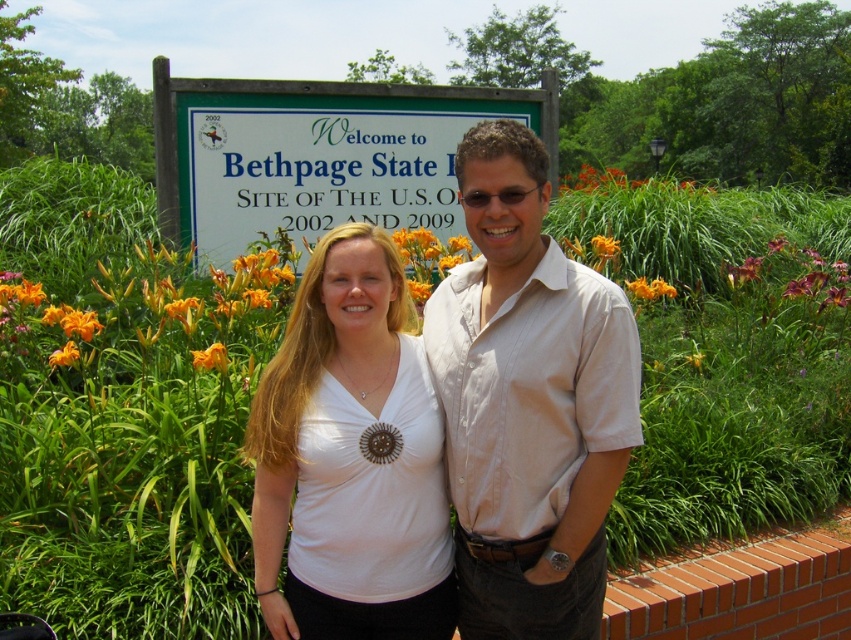
Between point (270, 104) and point (647, 289), which one is positioned behind?

Point (270, 104)

Identify the location of green plastic sign at upper center. (317, 154).

The height and width of the screenshot is (640, 851). Identify the location of green plastic sign at upper center. (317, 154).

Does light beige shirt at center lie behind orange matte flower at right?

No, light beige shirt at center is in front of orange matte flower at right.

Identify the location of light beige shirt at center. This screenshot has height=640, width=851. (x=528, y=401).

Who is more distant from viewer, (600, 282) or (638, 280)?

The point (638, 280) is more distant.

Where is `light beige shirt at center`? The height and width of the screenshot is (640, 851). light beige shirt at center is located at coordinates (528, 401).

Who is positioned more to the right, orange petal at upper right or orange/yellow petals at center?

Positioned to the right is orange petal at upper right.

Which is in front, point (666, 180) or point (609, 253)?

Point (609, 253) is in front.

The height and width of the screenshot is (640, 851). Describe the element at coordinates (623, 182) in the screenshot. I see `orange petal at upper right` at that location.

The height and width of the screenshot is (640, 851). Find the location of `orange petal at upper right`. orange petal at upper right is located at coordinates (623, 182).